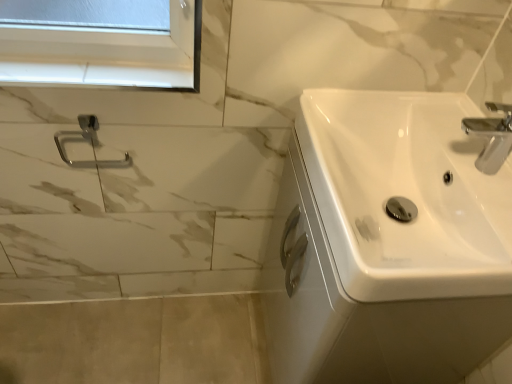
Question: Does white glossy window sill at upper left come in front of satin nickel towel ring at upper left?

Choices:
 (A) no
 (B) yes

Answer: (B)

Question: Is white glossy window sill at upper left looking in the opposite direction of satin nickel towel ring at upper left?

Choices:
 (A) no
 (B) yes

Answer: (A)

Question: Is white glossy window sill at upper left at the right side of satin nickel towel ring at upper left?

Choices:
 (A) no
 (B) yes

Answer: (B)

Question: Does white glossy window sill at upper left have a larger size compared to satin nickel towel ring at upper left?

Choices:
 (A) no
 (B) yes

Answer: (A)

Question: Is white glossy window sill at upper left facing towards satin nickel towel ring at upper left?

Choices:
 (A) no
 (B) yes

Answer: (A)

Question: Is white glossy window sill at upper left taller than satin nickel towel ring at upper left?

Choices:
 (A) no
 (B) yes

Answer: (A)

Question: Is satin nickel towel ring at upper left aimed at white glossy sink at right?

Choices:
 (A) no
 (B) yes

Answer: (A)

Question: Considering the relative sizes of satin nickel towel ring at upper left and white glossy sink at right in the image provided, is satin nickel towel ring at upper left taller than white glossy sink at right?

Choices:
 (A) no
 (B) yes

Answer: (A)

Question: Is white glossy sink at right completely or partially inside satin nickel towel ring at upper left?

Choices:
 (A) no
 (B) yes

Answer: (A)

Question: Is satin nickel towel ring at upper left positioned before white glossy sink at right?

Choices:
 (A) no
 (B) yes

Answer: (A)

Question: Is satin nickel towel ring at upper left to the right of white glossy sink at right from the viewer's perspective?

Choices:
 (A) yes
 (B) no

Answer: (B)

Question: Does satin nickel towel ring at upper left have a greater width compared to white glossy sink at right?

Choices:
 (A) no
 (B) yes

Answer: (A)

Question: From the image's perspective, would you say white glossy sink at right is positioned over white glossy window sill at upper left?

Choices:
 (A) yes
 (B) no

Answer: (B)